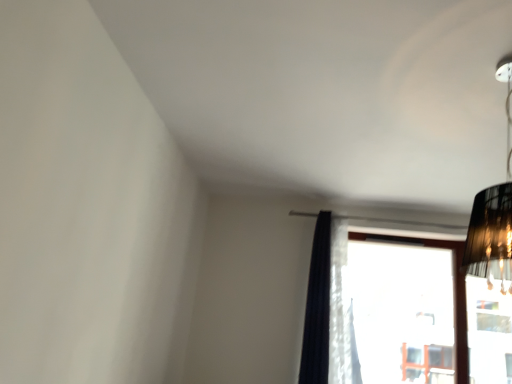
Identify the location of dark blue sheer curtain at center. The image size is (512, 384). (328, 310).

Locate an element on the screen. Image resolution: width=512 pixels, height=384 pixels. transparent glass window at center is located at coordinates (399, 313).

Where is `dark blue sheer curtain at center`? The width and height of the screenshot is (512, 384). dark blue sheer curtain at center is located at coordinates (328, 310).

What's the angular difference between black fabric lampshade at upper right and dark blue sheer curtain at center's facing directions?

They differ by 0.0467 degrees in their facing directions.

From a real-world perspective, between black fabric lampshade at upper right and dark blue sheer curtain at center, who is vertically higher?

black fabric lampshade at upper right is physically above.

Choose the correct answer: Is black fabric lampshade at upper right inside dark blue sheer curtain at center or outside it?

black fabric lampshade at upper right is located beyond the bounds of dark blue sheer curtain at center.

Considering the positions of point (308, 359) and point (358, 251), is point (308, 359) closer or farther from the camera than point (358, 251)?

Point (308, 359) is positioned closer to the camera compared to point (358, 251).

Is dark blue sheer curtain at center at the left side of transparent glass window at center?

Correct, you'll find dark blue sheer curtain at center to the left of transparent glass window at center.

At what (x,y) coordinates should I click in order to perform the action: click on window below the dark blue sheer curtain at center (from the image's perspective). Please return your answer as a coordinate pair (x, y). The image size is (512, 384). Looking at the image, I should click on (399, 313).

Identify the location of window located underneath the dark blue sheer curtain at center (from a real-world perspective). Image resolution: width=512 pixels, height=384 pixels. (399, 313).

Which of these two, transparent glass window at center or dark blue sheer curtain at center, is thinner?

Thinner between the two is transparent glass window at center.

From the picture: From a real-world perspective, is transparent glass window at center over dark blue sheer curtain at center?

No.

Does transparent glass window at center have a lesser height compared to dark blue sheer curtain at center?

Correct, transparent glass window at center is not as tall as dark blue sheer curtain at center.

Is dark blue sheer curtain at center further to the viewer compared to black fabric lampshade at upper right?

Yes.

Is dark blue sheer curtain at center surrounding black fabric lampshade at upper right?

No, black fabric lampshade at upper right is located outside of dark blue sheer curtain at center.

Are dark blue sheer curtain at center and black fabric lampshade at upper right making contact?

dark blue sheer curtain at center is not next to black fabric lampshade at upper right, and they're not touching.

Is point (330, 353) more distant than point (489, 273)?

Yes.

Is black fabric lampshade at upper right bigger than transparent glass window at center?

Actually, black fabric lampshade at upper right might be smaller than transparent glass window at center.

Is black fabric lampshade at upper right oriented towards transparent glass window at center?

No, black fabric lampshade at upper right is not facing towards transparent glass window at center.

Which object is positioned more to the left, black fabric lampshade at upper right or transparent glass window at center?

Positioned to the left is black fabric lampshade at upper right.

Locate an element on the screen. The height and width of the screenshot is (384, 512). window lying below the black fabric lampshade at upper right (from the image's perspective) is located at coordinates coord(399,313).

Between transparent glass window at center and black fabric lampshade at upper right, which one has smaller width?

With smaller width is transparent glass window at center.

Can we say transparent glass window at center lies outside black fabric lampshade at upper right?

That's correct, transparent glass window at center is outside of black fabric lampshade at upper right.

I want to click on lamp lying above the dark blue sheer curtain at center (from the image's perspective), so click(x=493, y=215).

Identify the location of window on the right of dark blue sheer curtain at center. (399, 313).

From the image, which object appears to be nearer to transparent glass window at center, black fabric lampshade at upper right or dark blue sheer curtain at center?

Based on the image, dark blue sheer curtain at center appears to be nearer to transparent glass window at center.

Estimate the real-world distances between objects in this image. Which object is closer to black fabric lampshade at upper right, transparent glass window at center or dark blue sheer curtain at center?

dark blue sheer curtain at center lies closer to black fabric lampshade at upper right than the other object.

Considering their positions, is dark blue sheer curtain at center positioned further to black fabric lampshade at upper right than transparent glass window at center?

transparent glass window at center is positioned further to the anchor black fabric lampshade at upper right.

Estimate the real-world distances between objects in this image. Which object is closer to transparent glass window at center, dark blue sheer curtain at center or black fabric lampshade at upper right?

dark blue sheer curtain at center lies closer to transparent glass window at center than the other object.

When comparing their distances from dark blue sheer curtain at center, does black fabric lampshade at upper right or transparent glass window at center seem closer?

black fabric lampshade at upper right lies closer to dark blue sheer curtain at center than the other object.

In the scene shown: Which object lies further to the anchor point dark blue sheer curtain at center, transparent glass window at center or black fabric lampshade at upper right?

Based on the image, transparent glass window at center appears to be further to dark blue sheer curtain at center.

At what (x,y) coordinates should I click in order to perform the action: click on curtain between black fabric lampshade at upper right and transparent glass window at center in the front-back direction. Please return your answer as a coordinate pair (x, y). Looking at the image, I should click on (328, 310).